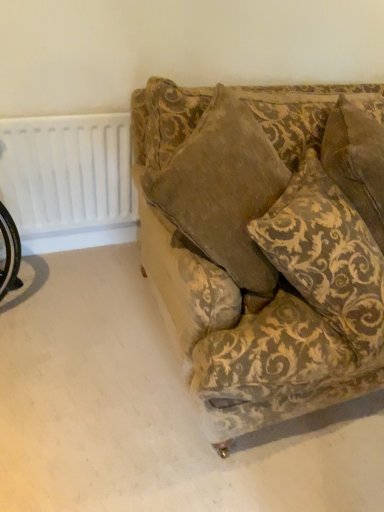
Question: Is white plastic radiator at upper left bigger or smaller than velvet-patterned couch at center?

Choices:
 (A) small
 (B) big

Answer: (A)

Question: Is white plastic radiator at upper left in front of or behind velvet-patterned couch at center in the image?

Choices:
 (A) behind
 (B) front

Answer: (A)

Question: Which object is the closest to the gold-patterned fabric pillow at upper right?

Choices:
 (A) velvet-patterned couch at center
 (B) white plastic radiator at upper left

Answer: (A)

Question: Considering the real-world distances, which object is farthest from the gold-patterned fabric pillow at upper right?

Choices:
 (A) white plastic radiator at upper left
 (B) velvet-patterned couch at center

Answer: (A)